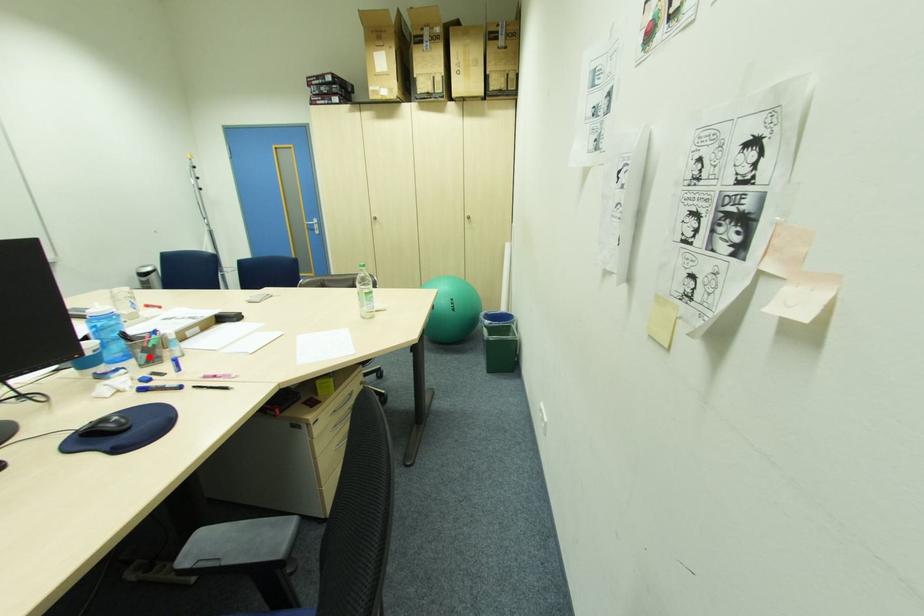
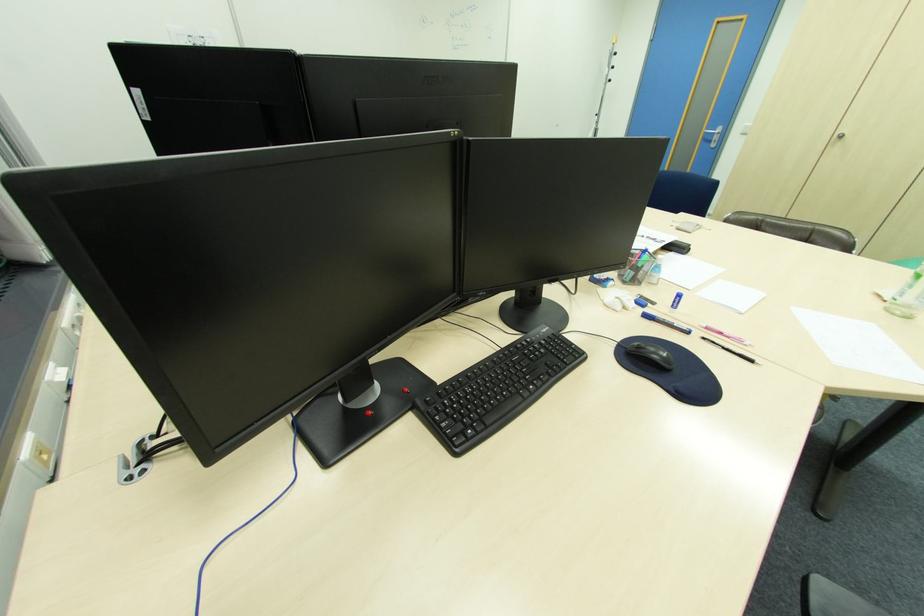
Locate, in the second image, the point that corresponds to the highlighted location in the first image.

(637, 274)